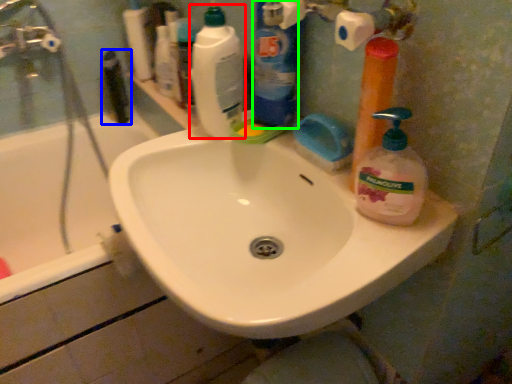
Question: Which object is the farthest from cleaning product (highlighted by a red box)? Choose among these: toiletry (highlighted by a blue box) or cleaning product (highlighted by a green box).

Choices:
 (A) toiletry
 (B) cleaning product

Answer: (A)